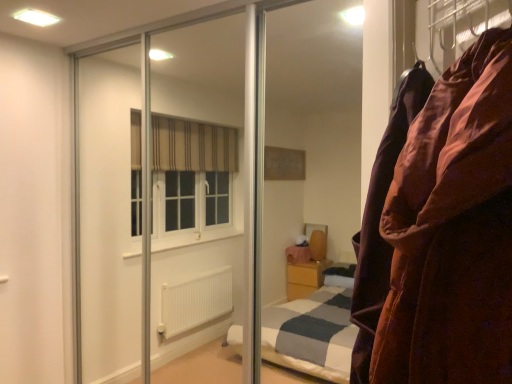
This screenshot has width=512, height=384. What do you see at coordinates (452, 230) in the screenshot? I see `velvet brown coat at right` at bounding box center [452, 230].

The width and height of the screenshot is (512, 384). I want to click on velvet brown coat at right, so click(452, 230).

Locate an element on the screen. Image resolution: width=512 pixels, height=384 pixels. velvet brown coat at right is located at coordinates (452, 230).